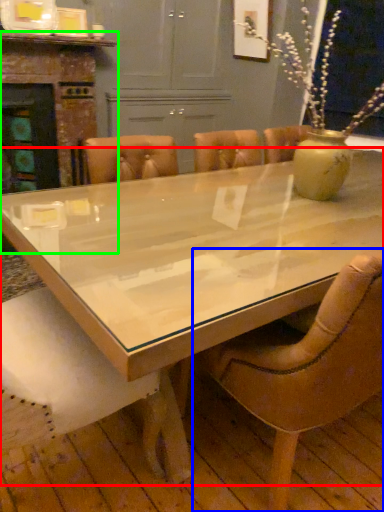
Question: Which object is the closest to the coffee table (highlighted by a red box)? Choose among these: chair (highlighted by a blue box) or fireplace (highlighted by a green box).

Choices:
 (A) chair
 (B) fireplace

Answer: (A)